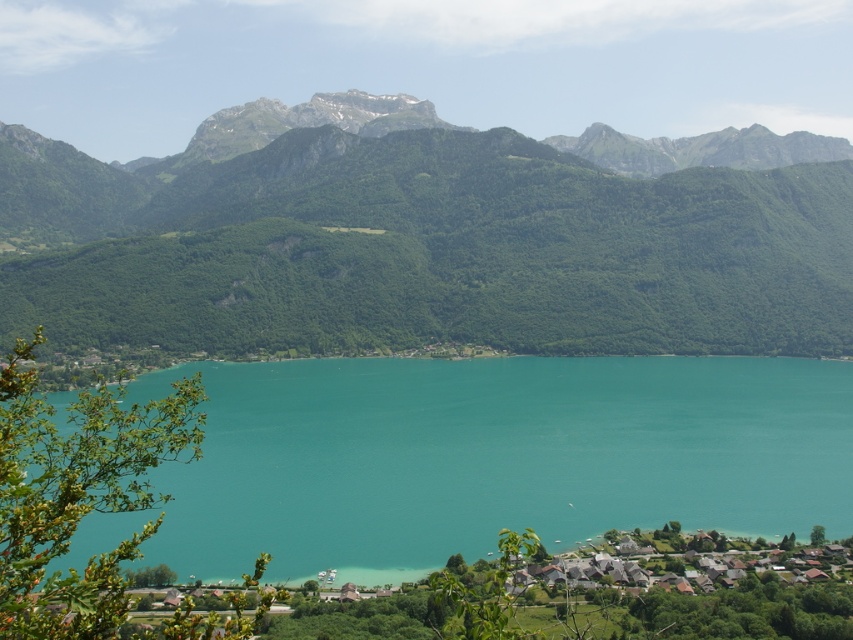
Who is taller, green forested mountain at center or white wooden houses at lower right?

green forested mountain at center is taller.

Between point (228, 180) and point (625, 544), which one is positioned in front?

Point (625, 544)

Find the location of `green forested mountain at center`. green forested mountain at center is located at coordinates (433, 237).

Can you confirm if turquoise water at center is positioned to the right of white wooden houses at lower right?

Yes, turquoise water at center is to the right of white wooden houses at lower right.

Identify the location of turquoise water at center. The height and width of the screenshot is (640, 853). (494, 458).

Does point (419, 419) come behind point (776, 582)?

That is True.

The height and width of the screenshot is (640, 853). I want to click on turquoise water at center, so (494, 458).

What do you see at coordinates (433, 237) in the screenshot? I see `green forested mountain at center` at bounding box center [433, 237].

Measure the distance between green forested mountain at center and camera.

green forested mountain at center and camera are 1626.37 feet apart.

Identify the location of green forested mountain at center. (433, 237).